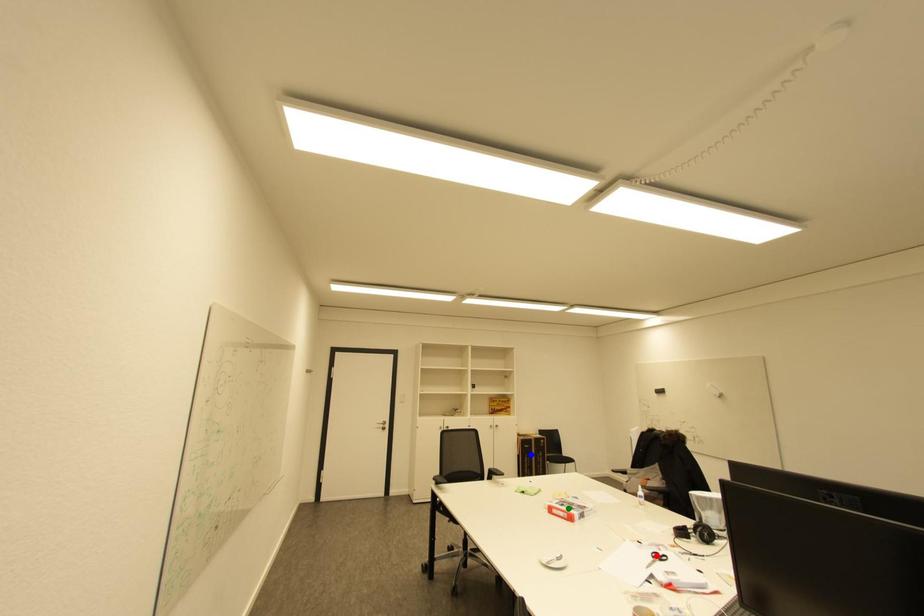
Order these from farthest to nearest:
1. blue point
2. red point
3. green point

blue point < green point < red point